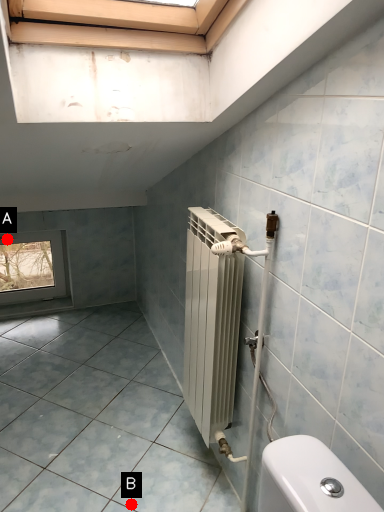
Question: Two points are circled on the image, labeled by A and B beside each circle. Among these points, which one is nearest to the camera?

Choices:
 (A) A is closer
 (B) B is closer

Answer: (B)